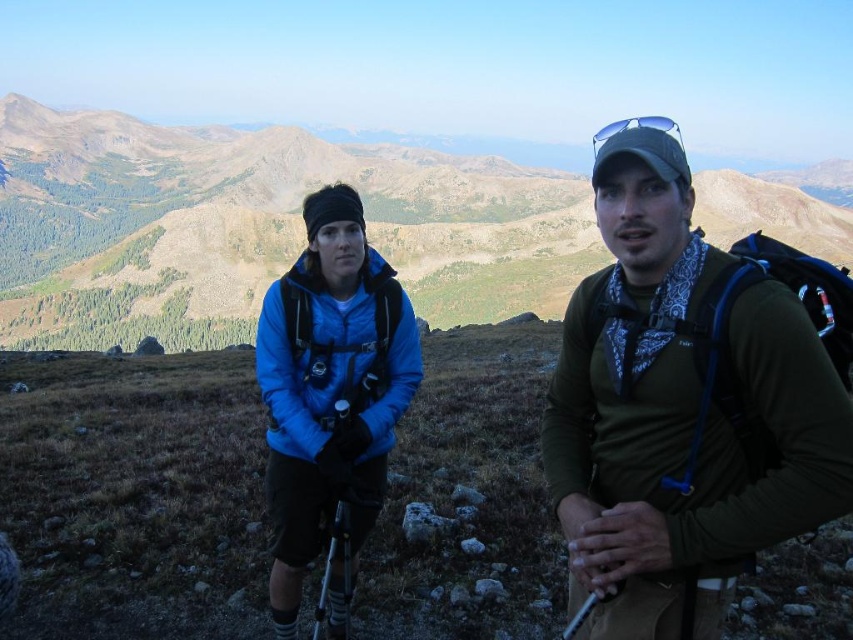
In the scene shown: Who is more forward, [531,227] or [363,417]?

Point [363,417] is more forward.

Is smooth brown mountain at center further to camera compared to matte blue jacket at center?

That is True.

Locate an element on the screen. The height and width of the screenshot is (640, 853). smooth brown mountain at center is located at coordinates (254, 227).

You are a GUI agent. You are given a task and a screenshot of the screen. Output one action in this format:
    pyautogui.click(x=<x>, y=<y>)
    Task: Click on the smooth brown mountain at center
    This screenshot has height=640, width=853.
    Given the screenshot: What is the action you would take?
    pyautogui.click(x=254, y=227)

How much distance is there between green matte shirt at center and matte blue jacket at center?

A distance of 12.95 meters exists between green matte shirt at center and matte blue jacket at center.

Between green matte shirt at center and matte blue jacket at center, which one is positioned lower?

matte blue jacket at center is below.

In order to click on green matte shirt at center in this screenshot , I will do `click(688, 401)`.

Which is behind, point (621, 218) or point (373, 168)?

Point (373, 168)

What do you see at coordinates (688, 401) in the screenshot? This screenshot has height=640, width=853. I see `green matte shirt at center` at bounding box center [688, 401].

Between point (584, 388) and point (457, 307), which one is positioned in front?

Point (584, 388) is in front.

Identify the location of green matte shirt at center. (688, 401).